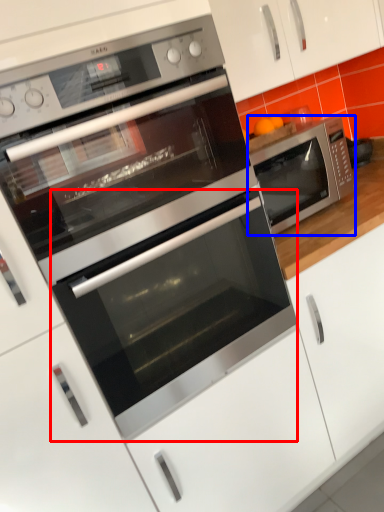
Question: Which of the following is the closest to the observer, oven (highlighted by a red box) or microwave oven (highlighted by a blue box)?

Choices:
 (A) oven
 (B) microwave oven

Answer: (A)